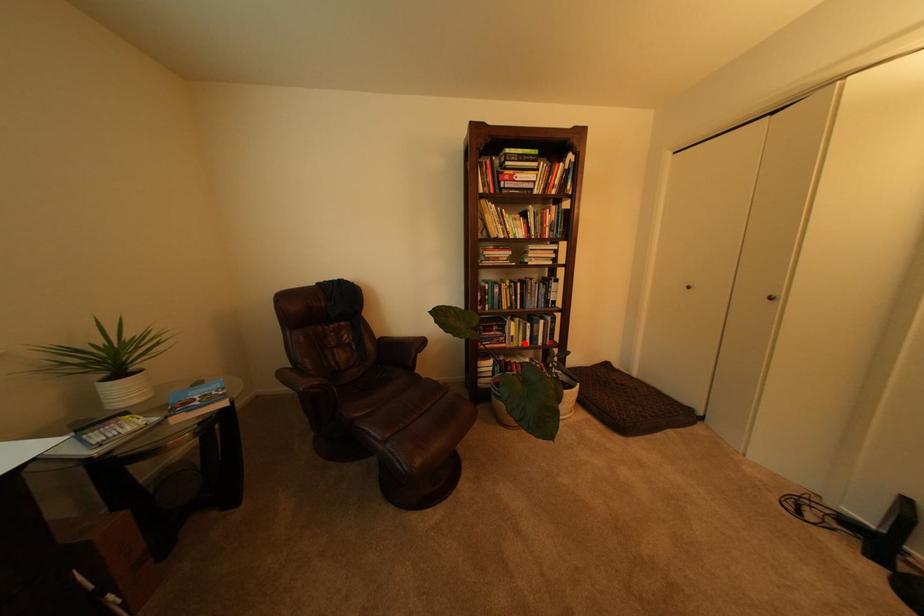
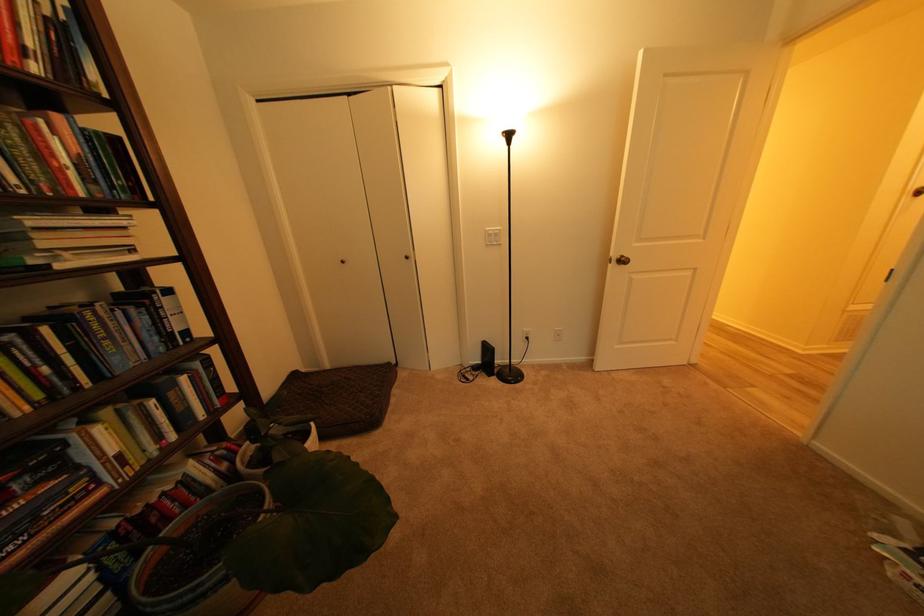
Where in the second image is the point corresponding to the highlighted location from the first image?

(141, 463)